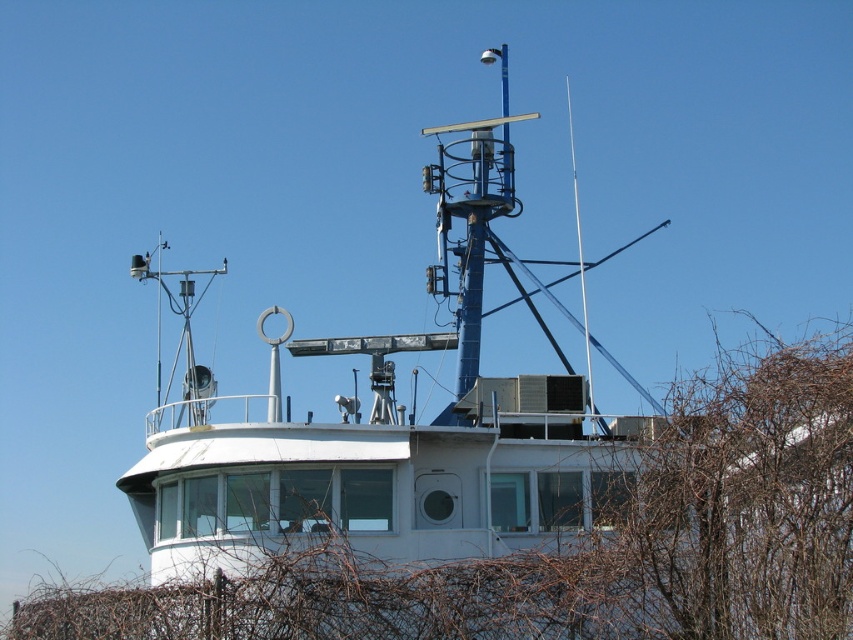
You are on a boat and looking at the scene. There is a white matte boat at center and brown leafless branches at lower right. Which object is closer to you?

The brown leafless branches at lower right is positioned under white matte boat at center, so the brown leafless branches at lower right is closer to you.

Based on the photo, you are standing on the deck of the white matte boat at center and looking towards the brown leafless branches at lower right. Are the branches closer to you than the boat?

The brown leafless branches at lower right is closer to the viewer than white matte boat at center, so yes, the branches are closer to you than the boat.

You are a sailor on a white matte boat at center and you need to reach the brown leafless branches at lower right to retrieve a fallen tool. Can you safely reach them with a 6.5 meter long pole?

The distance between the brown leafless branches at lower right and the white matte boat at center is 6.64 meters. Since the pole is only 6.5 meters long, it is 0.14 meters too short to reach the branches safely.